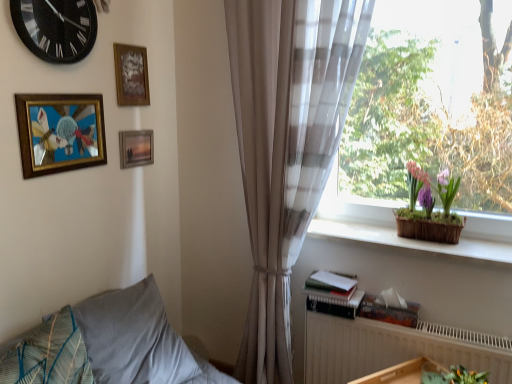
Question: Is point (424, 82) closer or farther from the camera than point (292, 69)?

Choices:
 (A) closer
 (B) farther

Answer: (B)

Question: From the image's perspective, is translucent fabric at right located above or below sheer beige curtain at right?

Choices:
 (A) above
 (B) below

Answer: (A)

Question: Which object is positioned farthest from the wooden basket at right?

Choices:
 (A) sheer beige curtain at right
 (B) wooden frame at upper center, positioned as the 1th picture frame in back-to-front order
 (C) translucent fabric at right
 (D) gray fabric pillow at lower left, which ranks as the 2th pillow in front-to-back order
 (E) gold-framed artwork at upper left, which is the third picture frame in back-to-front order

Answer: (E)

Question: Which object is positioned closest to the gray fabric pillow at lower left, which ranks as the 1th pillow in back-to-front order?

Choices:
 (A) translucent fabric at right
 (B) black glass clock at upper left
 (C) wooden frame at upper center, acting as the second picture frame starting from the back
 (D) sheer beige curtain at right
 (E) textured blue pillow at lower left, the 2th pillow in the back-to-front sequence

Answer: (E)